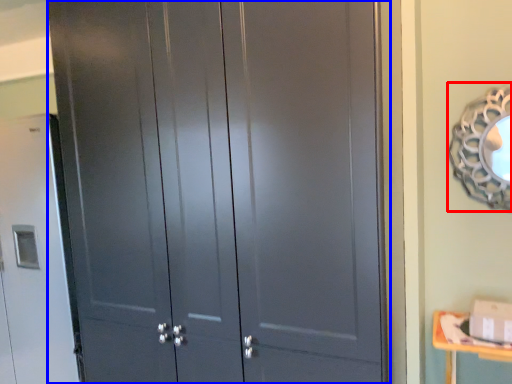
Question: Among these objects, which one is nearest to the camera, mirror (highlighted by a red box) or door (highlighted by a blue box)?

Choices:
 (A) mirror
 (B) door

Answer: (B)